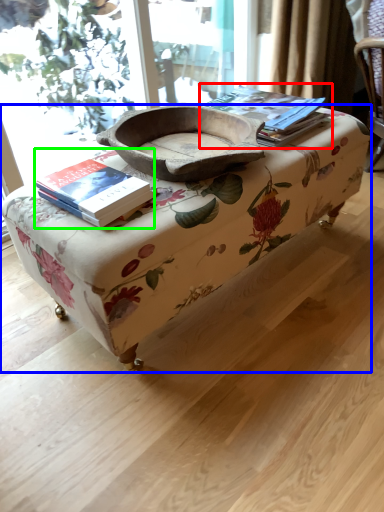
Question: Which object is the farthest from paperback book (highlighted by a red box)? Choose among these: table (highlighted by a blue box) or book (highlighted by a green box).

Choices:
 (A) table
 (B) book

Answer: (B)